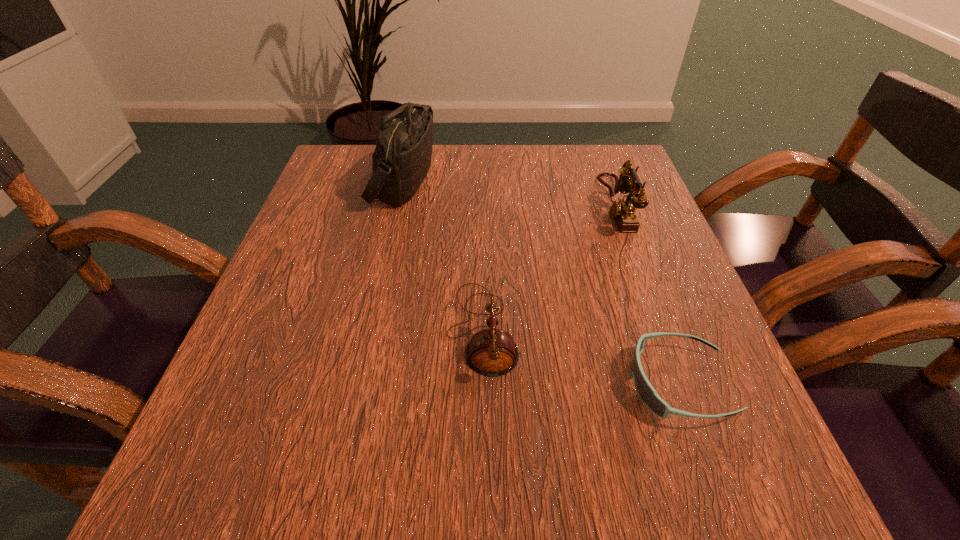
Identify the location of free point between the goggles and the tallest object. Image resolution: width=960 pixels, height=540 pixels. (540, 282).

Identify the location of free spot between the shoulder bag and the farther telephone. The width and height of the screenshot is (960, 540). (509, 193).

Identify the location of vacant area between the nearer telephone and the shoulder bag. (443, 255).

In order to click on free space between the farther telephone and the shoulder bag in this screenshot , I will do `click(509, 193)`.

Where is `vacant area that lies between the shorter telephone and the right telephone`? The height and width of the screenshot is (540, 960). vacant area that lies between the shorter telephone and the right telephone is located at coordinates (549, 267).

Locate an element on the screen. empty space between the left telephone and the right telephone is located at coordinates (549, 267).

Locate an element on the screen. free point between the right telephone and the leftmost object is located at coordinates (509, 193).

Image resolution: width=960 pixels, height=540 pixels. Find the location of `vacant area between the leftmost object and the farther telephone`. vacant area between the leftmost object and the farther telephone is located at coordinates (509, 193).

Locate an element on the screen. This screenshot has height=540, width=960. free space that is in between the tallest object and the taller telephone is located at coordinates (509, 193).

Locate an element on the screen. object that is the nearest to the tallest object is located at coordinates (491, 352).